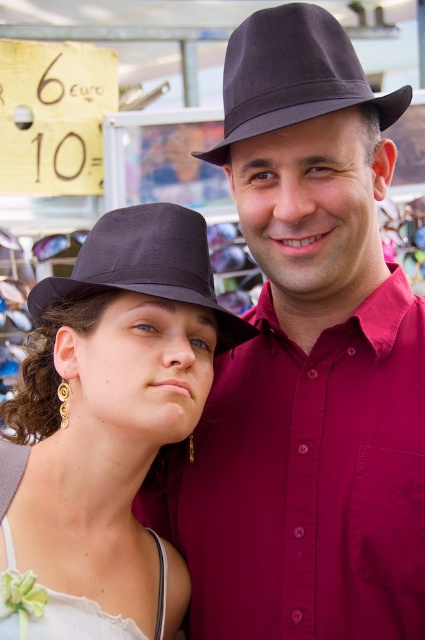
Can you confirm if matte black hat at upper left is bigger than matte black fedora at upper left?

Correct, matte black hat at upper left is larger in size than matte black fedora at upper left.

Who is more forward, (x=189, y=228) or (x=198, y=275)?

Positioned in front is point (x=198, y=275).

Who is more distant from viewer, (x=141, y=586) or (x=96, y=268)?

The point (x=141, y=586) is behind.

Identify the location of matte black hat at upper left. (107, 428).

Does matte black fedora at upper left have a smaller size compared to white satin dress at lower left?

Incorrect, matte black fedora at upper left is not smaller in size than white satin dress at lower left.

Can you confirm if matte black fedora at upper left is positioned below white satin dress at lower left?

No, matte black fedora at upper left is not below white satin dress at lower left.

This screenshot has width=425, height=640. What do you see at coordinates (144, 266) in the screenshot? I see `matte black fedora at upper left` at bounding box center [144, 266].

At what (x,y) coordinates should I click in order to perform the action: click on matte black fedora at upper left. Please return your answer as a coordinate pair (x, y). This screenshot has height=640, width=425. Looking at the image, I should click on (144, 266).

Does matte black hat at center have a smaller size compared to white satin dress at lower left?

No.

Which of these two, matte black hat at center or white satin dress at lower left, stands shorter?

With less height is white satin dress at lower left.

Consider the image. Who is more distant from viewer, (370, 305) or (6, 637)?

The point (370, 305) is more distant.

You are a GUI agent. You are given a task and a screenshot of the screen. Output one action in this format:
    pyautogui.click(x=<x>, y=<y>)
    Task: Click on the matte black hat at center
    
    Given the screenshot: What is the action you would take?
    pyautogui.click(x=306, y=364)